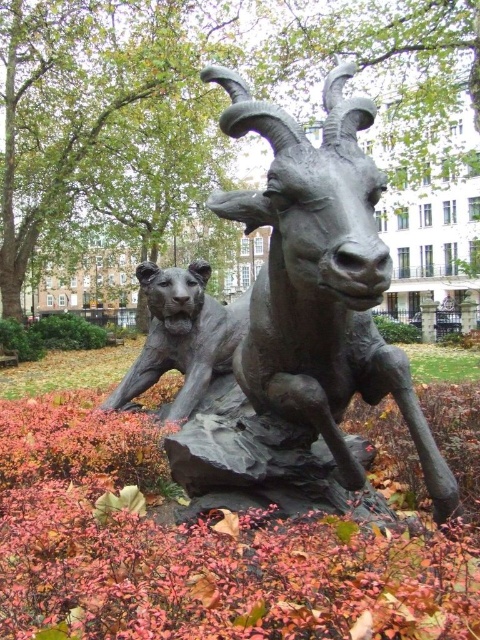
You are standing in front of the bronze sculpture of a goat and a lioness in the park. You notice two specific points on the sculpture marked at coordinates point (127,518) and point (343,314). If you want to touch the point that is closer to you, which coordinate should you reach for?

You should reach for point (127,518) because it is closer to the viewer than point (343,314).

You are an art student planning to photograph the bronze statue at center and the shiny bronze tiger at center for a project. You want to ensure both subjects are clearly visible in the frame. Based on their sizes, which one should you focus on first to ensure proper framing?

The bronze statue at center is larger than the shiny bronze tiger at center, so you should focus on the bronze statue at center first to ensure it fits well within the frame before adjusting for the smaller shiny bronze tiger at center.

You are a visitor in the park and want to take a photo of the bronze statue at center and the bronze textured goat at center. If you stand to the left of both objects, which one will appear closer to you in the photo?

The bronze textured goat at center will appear closer to you in the photo because the bronze statue at center is positioned on the right side of bronze textured goat at center, meaning the goat is closer to your left side position.